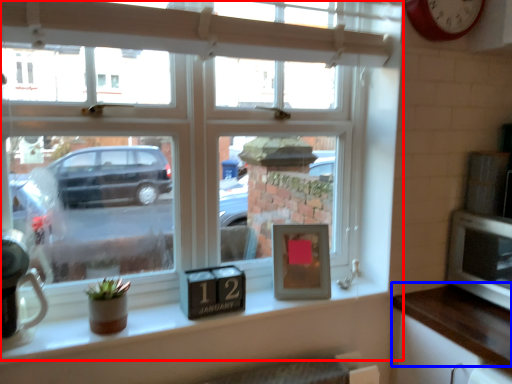
Question: Among these objects, which one is nearest to the camera, window (highlighted by a red box) or counter top (highlighted by a blue box)?

Choices:
 (A) window
 (B) counter top

Answer: (A)